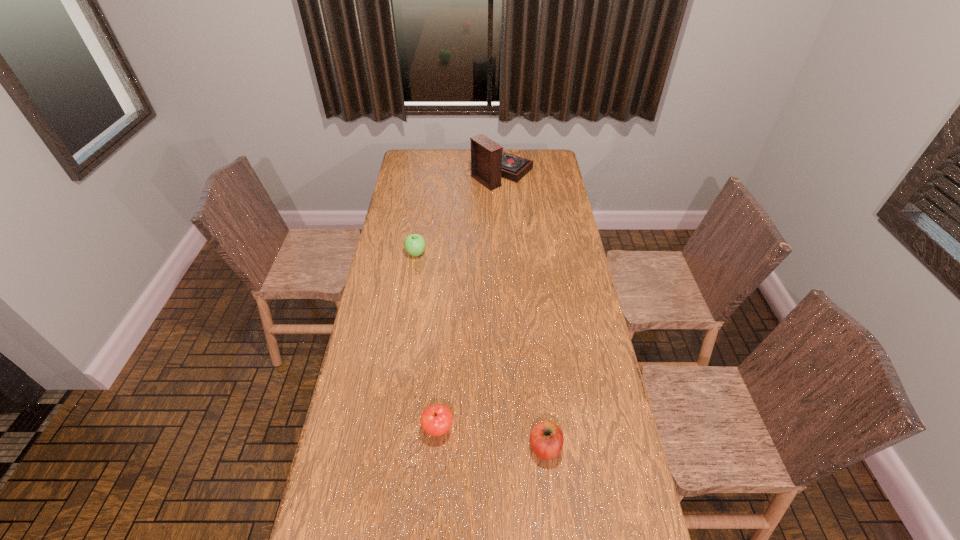
Locate an element on the screen. Image resolution: width=960 pixels, height=540 pixels. vacant space that is in between the second apple from left to right and the second farthest object is located at coordinates (427, 341).

Image resolution: width=960 pixels, height=540 pixels. I want to click on vacant point located between the rightmost apple and the leftmost apple, so click(480, 350).

This screenshot has width=960, height=540. I want to click on free space between the second apple from right to left and the leftmost apple, so click(x=427, y=341).

Identify the location of vacant space that's between the farthest apple and the tallest object. Image resolution: width=960 pixels, height=540 pixels. (457, 213).

I want to click on vacant area that lies between the rightmost apple and the second apple from left to right, so click(x=492, y=437).

What are the coordinates of `vacant region between the second apple from left to right and the tallest object` in the screenshot? It's located at (468, 301).

Find the location of `unoccupied position between the farthest apple and the rightmost apple`. unoccupied position between the farthest apple and the rightmost apple is located at coordinates (480, 350).

The width and height of the screenshot is (960, 540). Find the location of `free space between the second apple from right to left and the second farthest object`. free space between the second apple from right to left and the second farthest object is located at coordinates (427, 341).

At what (x,y) coordinates should I click in order to perform the action: click on object that is the closest one to the second apple from right to left. Please return your answer as a coordinate pair (x, y). This screenshot has width=960, height=540. Looking at the image, I should click on (546, 438).

What are the coordinates of `object that is the third closest to the second apple from right to left` in the screenshot? It's located at (489, 163).